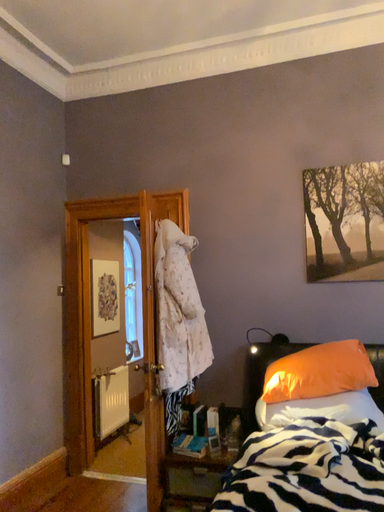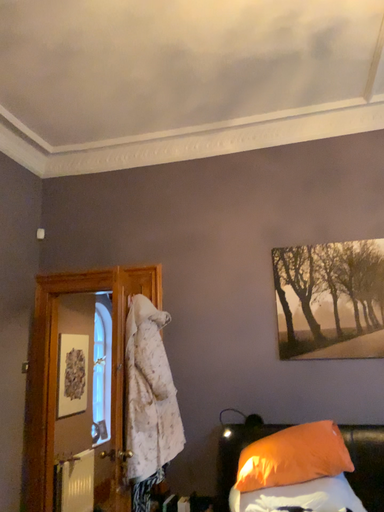
Question: How did the camera likely rotate when shooting the video?

Choices:
 (A) rotated downward
 (B) rotated upward

Answer: (B)